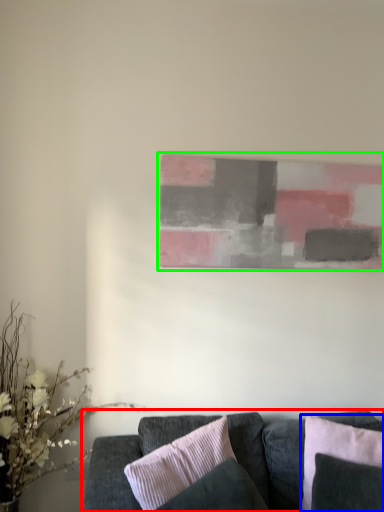
Question: Considering the real-world distances, which object is farthest from studio couch (highlighted by a red box)? pillow (highlighted by a blue box) or picture frame (highlighted by a green box)?

Choices:
 (A) pillow
 (B) picture frame

Answer: (B)